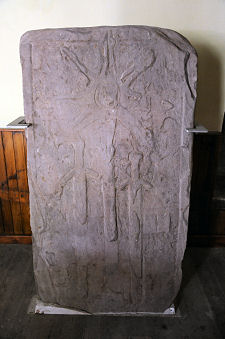
The height and width of the screenshot is (339, 225). Identify the location of wooden floor. (19, 291).